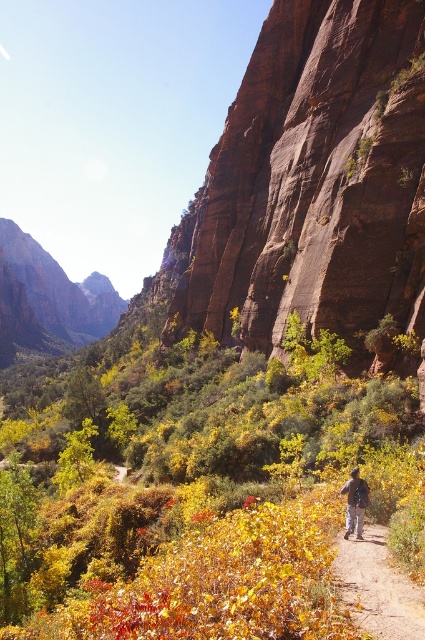
From the picture: Can you confirm if dirt path at center is smaller than dark blue jeans at center?

No, dirt path at center is not smaller than dark blue jeans at center.

Who is positioned more to the left, dirt path at center or dark blue jeans at center?

Positioned to the left is dirt path at center.

Image resolution: width=425 pixels, height=640 pixels. What do you see at coordinates (377, 588) in the screenshot?
I see `dirt path at center` at bounding box center [377, 588].

In order to click on dirt path at center in this screenshot , I will do `click(377, 588)`.